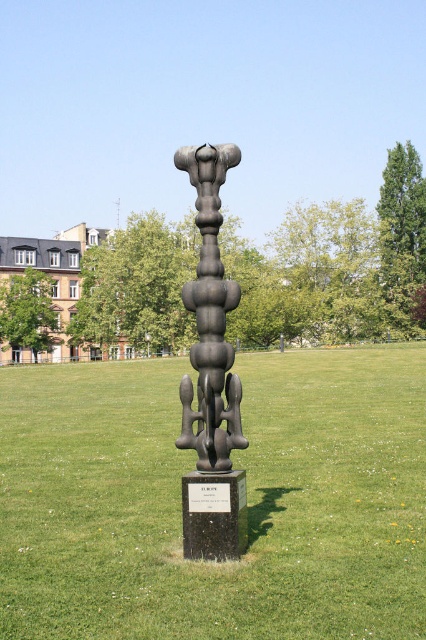
Question: Is black polished sculpture at center smaller than polished bronze sculpture at center?

Choices:
 (A) no
 (B) yes

Answer: (A)

Question: Among these points, which one is farthest from the camera?

Choices:
 (A) (207, 294)
 (B) (238, 356)

Answer: (B)

Question: Which point is closer to the camera taking this photo?

Choices:
 (A) (204, 280)
 (B) (348, 502)

Answer: (A)

Question: Which of the following is the farthest from the observer?

Choices:
 (A) polished bronze sculpture at center
 (B) black polished sculpture at center

Answer: (A)

Question: In this image, where is black polished sculpture at center located relative to polished bronze sculpture at center?

Choices:
 (A) right
 (B) left

Answer: (B)

Question: Does black polished sculpture at center have a greater width compared to polished bronze sculpture at center?

Choices:
 (A) no
 (B) yes

Answer: (B)